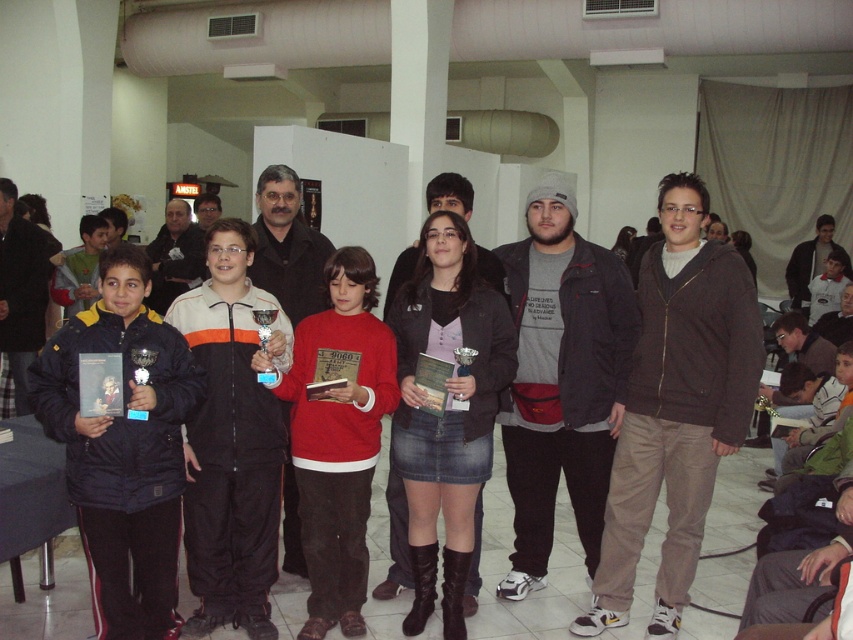
You are taking a photo of the award ceremony scene. You want to focus on the point at point (x=175, y=460) and point (x=341, y=540). Which point is closer to your camera?

Point (x=175, y=460) is closer to the camera than point (x=341, y=540).

You are standing at the center of the room and see two points marked in the image. The first point is at coordinate point (747, 488) and the second point is at coordinate point (489, 417). Which point is closer to you?

Point (489, 417) is closer to you because the point (747, 488) is behind it.

You are standing in the center of the room and want to hand a gift to the person wearing the black puffy jacket at left. Based on their position, which direction should you move to reach them?

The black puffy jacket at left is located at point 0.703 on the x axis and 0.145 on the y axis. Since you are at the center, moving towards the left side of the room would bring you closer to the black puffy jacket at left.